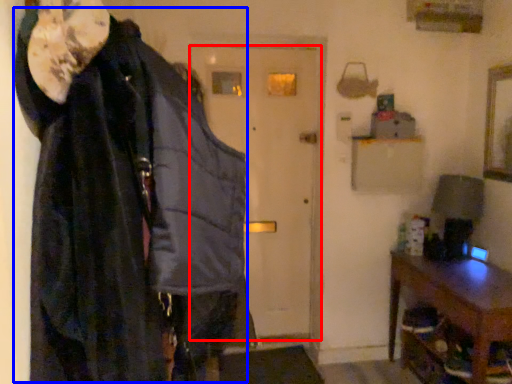
Question: Which point is further to the camera, door (highlighted by a red box) or cloak (highlighted by a blue box)?

Choices:
 (A) door
 (B) cloak

Answer: (A)